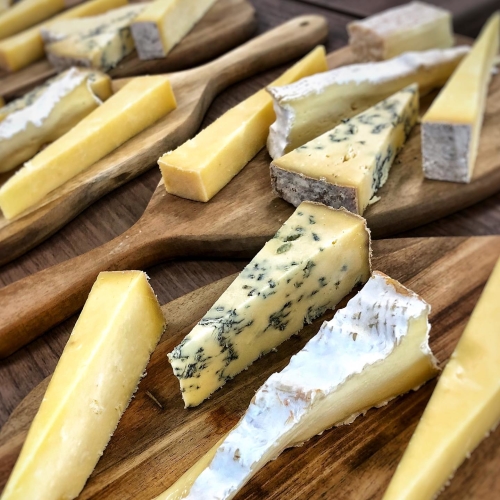
The image size is (500, 500). Find the location of `serving pallet`. serving pallet is located at coordinates (227, 22), (200, 80), (245, 195), (192, 300), (411, 195).